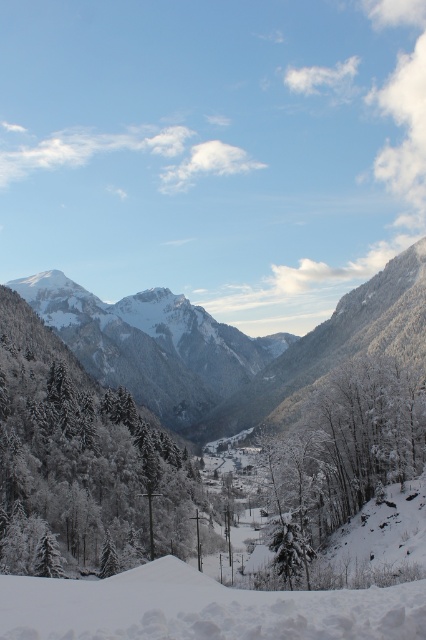
Question: Can you confirm if green matte tree at left is wider than white snow ski slope at lower center?

Choices:
 (A) no
 (B) yes

Answer: (B)

Question: Based on their relative distances, which object is farther from the green matte tree at left?

Choices:
 (A) white snow ski slope at lower center
 (B) white frosty trees at center
 (C) snowy granite mountain at center

Answer: (C)

Question: Which is nearer to the white frosty trees at center?

Choices:
 (A) white snow ski slope at lower center
 (B) green matte tree at left
 (C) snowy granite mountain at center

Answer: (A)

Question: Considering the relative positions of snowy granite mountain at center and white snow ski slope at lower center in the image provided, where is snowy granite mountain at center located with respect to white snow ski slope at lower center?

Choices:
 (A) above
 (B) below

Answer: (A)

Question: Can you confirm if snowy granite mountain at center is bigger than white snow ski slope at lower center?

Choices:
 (A) no
 (B) yes

Answer: (B)

Question: Which object is closer to the camera taking this photo?

Choices:
 (A) white frosty trees at center
 (B) snowy granite mountain at center

Answer: (A)